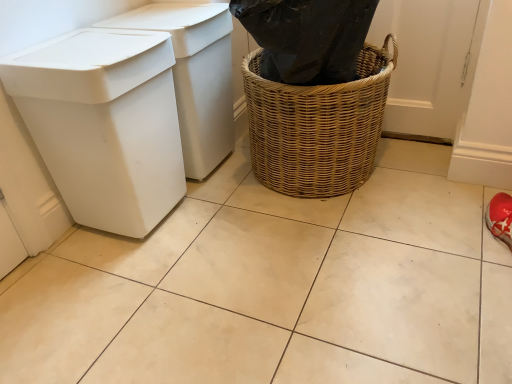
The image size is (512, 384). I want to click on vacant area on top of white plastic bin at left, the 1th waste container viewed from the front (from a real-world perspective), so click(88, 51).